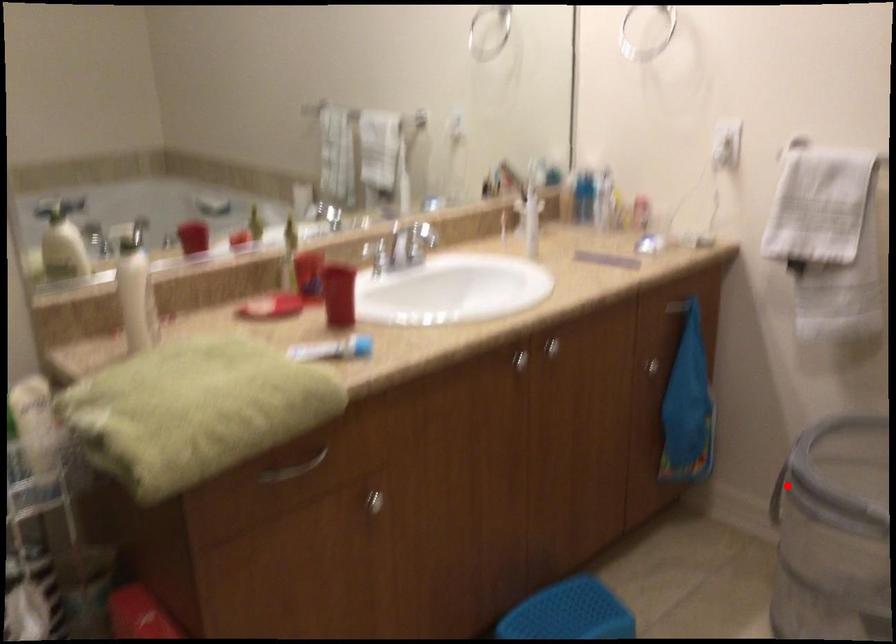
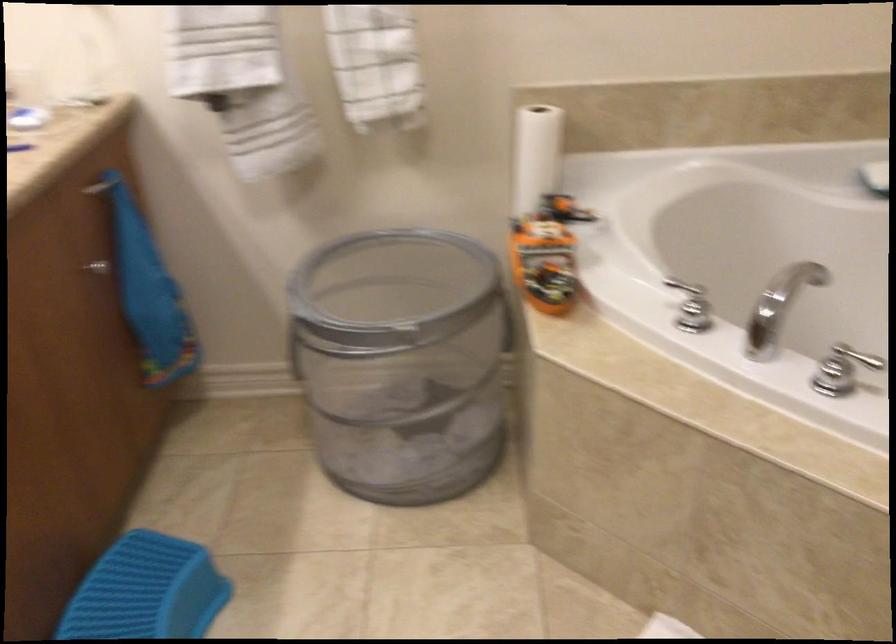
Question: I am providing you with two images of the same scene from different viewpoints. A red point is marked on the first image. At the location where the point appears in image 1, is it still visible in image 2?

Choices:
 (A) Yes
 (B) No

Answer: (A)